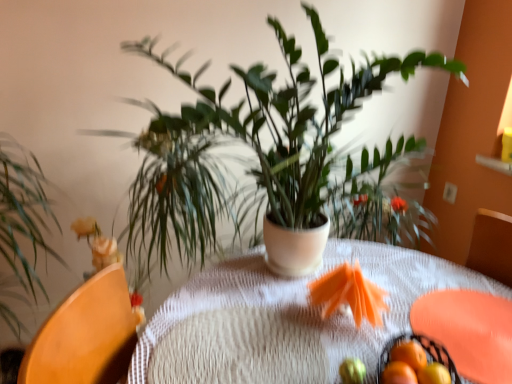
Question: Would you say green matte plant at center, which is the first houseplant in right-to-left order, is outside orange matte tangerine at lower right, the third tangerine positioned from the back?

Choices:
 (A) no
 (B) yes

Answer: (B)

Question: Is green matte plant at center, which is the first houseplant in right-to-left order, positioned with its back to orange matte tangerine at lower right, the 1th tangerine viewed from the front?

Choices:
 (A) yes
 (B) no

Answer: (B)

Question: Can you confirm if green matte plant at center, which is the first houseplant in right-to-left order, is positioned to the left of orange matte tangerine at lower right, the 1th tangerine viewed from the front?

Choices:
 (A) yes
 (B) no

Answer: (A)

Question: From the image's perspective, would you say green matte plant at center, which is the first houseplant in right-to-left order, is positioned over orange matte tangerine at lower right, the third tangerine positioned from the back?

Choices:
 (A) yes
 (B) no

Answer: (A)

Question: Is green matte plant at center, which is the first houseplant in right-to-left order, aimed at orange matte tangerine at lower right, the 1th tangerine viewed from the front?

Choices:
 (A) yes
 (B) no

Answer: (A)

Question: Considering the relative sizes of green matte plant at center, which is counted as the second houseplant, starting from the left, and orange matte tangerine at lower right, the third tangerine positioned from the back, in the image provided, is green matte plant at center, which is counted as the second houseplant, starting from the left, wider than orange matte tangerine at lower right, the third tangerine positioned from the back,?

Choices:
 (A) yes
 (B) no

Answer: (A)

Question: Can we say green matte plant at center, which is the first houseplant in right-to-left order, lies outside green leafy plant at left, acting as the first houseplant starting from the left?

Choices:
 (A) no
 (B) yes

Answer: (B)

Question: Can you confirm if green matte plant at center, which is counted as the second houseplant, starting from the left, is shorter than green leafy plant at left, acting as the first houseplant starting from the left?

Choices:
 (A) no
 (B) yes

Answer: (B)

Question: Considering the relative sizes of green matte plant at center, which is counted as the second houseplant, starting from the left, and green leafy plant at left, acting as the first houseplant starting from the left, in the image provided, is green matte plant at center, which is counted as the second houseplant, starting from the left, wider than green leafy plant at left, acting as the first houseplant starting from the left,?

Choices:
 (A) yes
 (B) no

Answer: (A)

Question: From a real-world perspective, is green matte plant at center, which is the first houseplant in right-to-left order, on green leafy plant at left, the 2th houseplant positioned from the right?

Choices:
 (A) no
 (B) yes

Answer: (B)

Question: Are green matte plant at center, which is the first houseplant in right-to-left order, and green leafy plant at left, the 2th houseplant positioned from the right, far apart?

Choices:
 (A) no
 (B) yes

Answer: (A)

Question: Considering the relative positions of green matte plant at center, which is counted as the second houseplant, starting from the left, and green leafy plant at left, the 2th houseplant positioned from the right, in the image provided, is green matte plant at center, which is counted as the second houseplant, starting from the left, to the right of green leafy plant at left, the 2th houseplant positioned from the right, from the viewer's perspective?

Choices:
 (A) yes
 (B) no

Answer: (A)

Question: Does orange matte tangerine at lower right, arranged as the third tangerine when viewed from the front, come behind smooth yellow fruit at center?

Choices:
 (A) yes
 (B) no

Answer: (A)